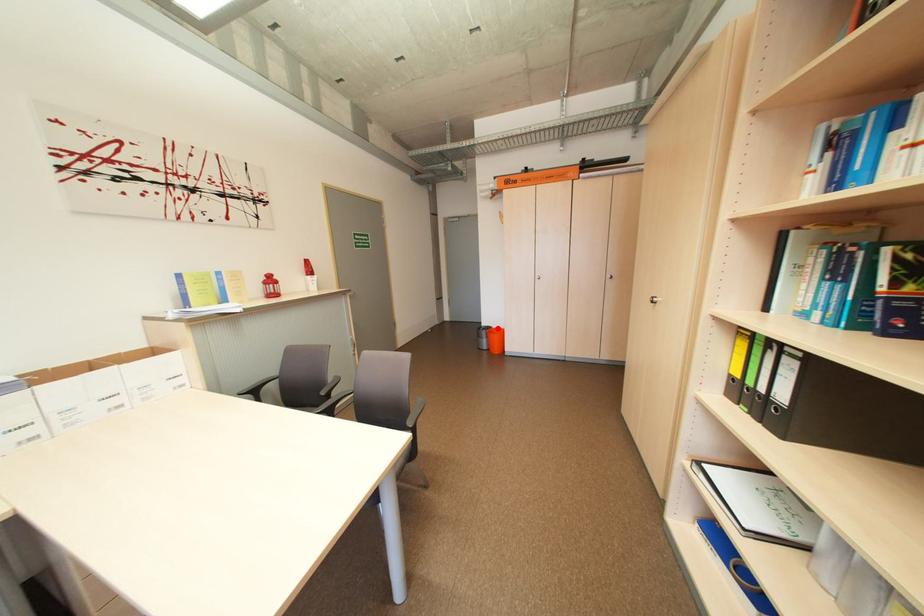
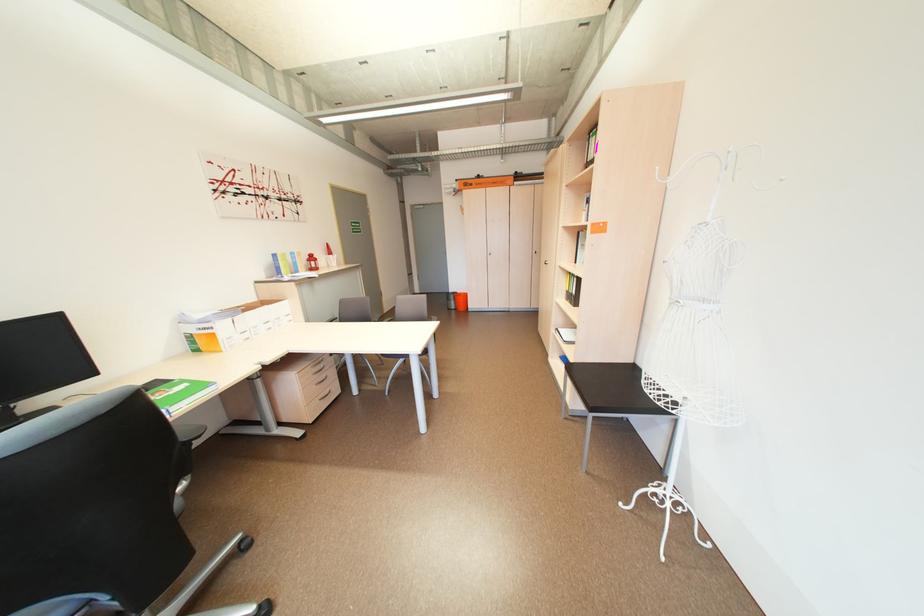
Locate, in the second image, the point that corresponds to the highlighted location in the first image.

(464, 294)